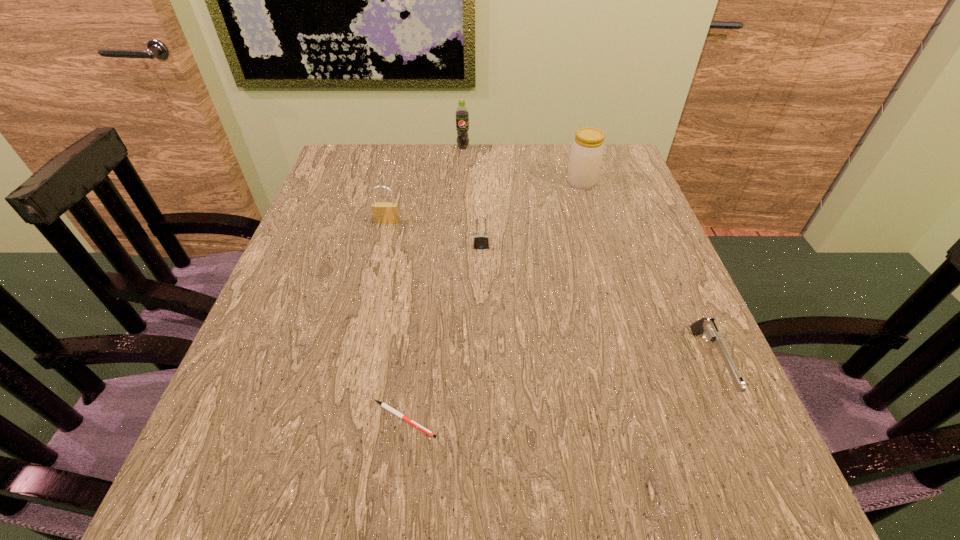
Image resolution: width=960 pixels, height=540 pixels. What are the coordinates of `object positioned at the far right corner` in the screenshot? It's located at (587, 150).

In the image, there is a desktop. At what (x,y) coordinates should I click in order to perform the action: click on vacant region at the far edge. Please return your answer as a coordinate pair (x, y). The height and width of the screenshot is (540, 960). Looking at the image, I should click on pos(425,154).

Identify the location of vacant region at the near edge of the desktop. (660, 503).

In order to click on free space at the left edge of the desktop in this screenshot , I will do pyautogui.click(x=370, y=237).

Identify the location of vacant space at the right edge of the desktop. (650, 328).

In the image, there is a desktop. Where is `vacant space at the near left corner`? vacant space at the near left corner is located at coordinates (269, 525).

What are the coordinates of `free space between the farthest object and the pen` in the screenshot? It's located at (434, 283).

Identify the location of vacant space that is in between the farthest object and the fifth nearest object. (522, 165).

I want to click on vacant point located between the jar and the pistol, so click(x=645, y=274).

I want to click on empty space between the farthest object and the fourth object from left to right, so click(472, 197).